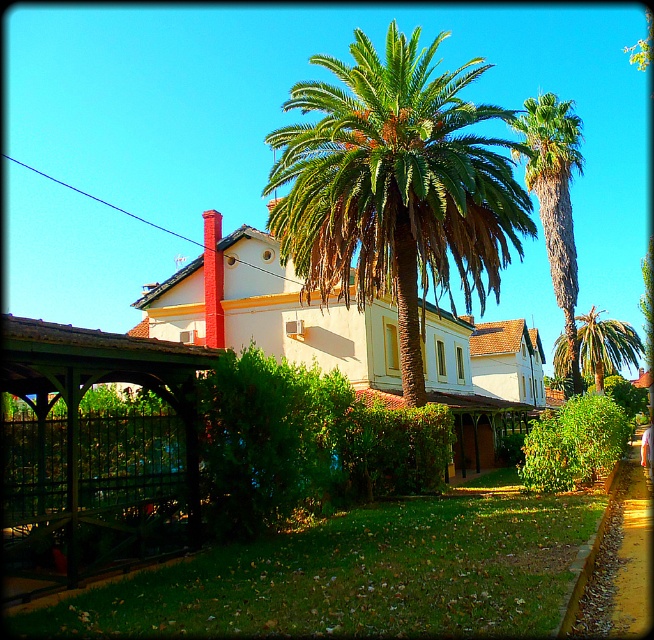
Question: Is green leafy palm at upper center closer to the viewer compared to green leafy palm tree at center?

Choices:
 (A) yes
 (B) no

Answer: (A)

Question: In this image, where is green leafy palm at center located relative to green leafy palm at upper center?

Choices:
 (A) below
 (B) above

Answer: (A)

Question: Does green leafy palm at center appear over green leafy palm tree at center?

Choices:
 (A) no
 (B) yes

Answer: (B)

Question: Which object is farther from the camera taking this photo?

Choices:
 (A) green leafy palm tree at center
 (B) green leafy palm at center
 (C) green leafy palm at upper center

Answer: (A)

Question: Which point appears farthest from the camera in this image?

Choices:
 (A) (600, 342)
 (B) (547, 182)
 (C) (419, 29)

Answer: (C)

Question: Which of the following is the closest to the observer?

Choices:
 (A) green leafy palm tree at center
 (B) green leafy palm at center
 (C) green leafy palm at upper center

Answer: (B)